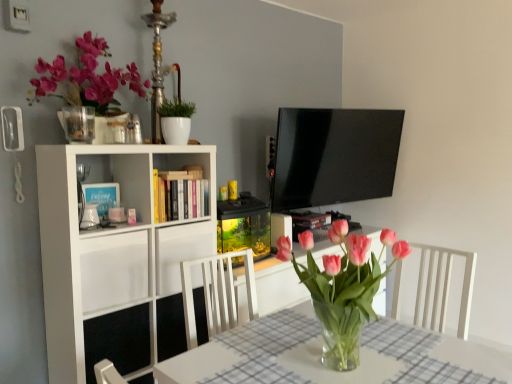
This screenshot has height=384, width=512. I want to click on free area below pink glass vase at center (from a real-world perspective), so click(337, 366).